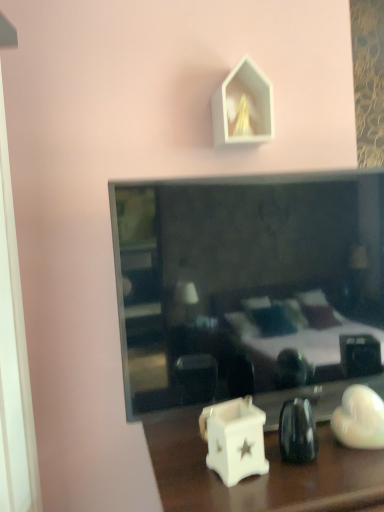
Question: From a real-world perspective, is white glossy candle holder at lower center located beneath white matte house-shaped object at upper center?

Choices:
 (A) no
 (B) yes

Answer: (B)

Question: From the image's perspective, is white glossy candle holder at lower center above white matte house-shaped object at upper center?

Choices:
 (A) yes
 (B) no

Answer: (B)

Question: Can you confirm if white glossy candle holder at lower center is shorter than white matte house-shaped object at upper center?

Choices:
 (A) yes
 (B) no

Answer: (B)

Question: Is white matte house-shaped object at upper center a part of white glossy candle holder at lower center?

Choices:
 (A) yes
 (B) no

Answer: (B)

Question: Is white glossy candle holder at lower center smaller than white matte house-shaped object at upper center?

Choices:
 (A) no
 (B) yes

Answer: (A)

Question: Looking at their shapes, would you say white matte house-shaped object at upper center is wider or thinner than white glossy candle holder at lower center?

Choices:
 (A) thin
 (B) wide

Answer: (A)

Question: Would you say white matte house-shaped object at upper center is inside or outside white glossy candle holder at lower center?

Choices:
 (A) outside
 (B) inside

Answer: (A)

Question: From the image's perspective, is white matte house-shaped object at upper center positioned above or below white glossy candle holder at lower center?

Choices:
 (A) above
 (B) below

Answer: (A)

Question: Is point (226, 111) closer or farther from the camera than point (183, 482)?

Choices:
 (A) farther
 (B) closer

Answer: (A)

Question: From the image's perspective, is smooth glass mirror at center above or below white matte house-shaped object at upper center?

Choices:
 (A) below
 (B) above

Answer: (A)

Question: Considering the positions of smooth glass mirror at center and white matte house-shaped object at upper center in the image, is smooth glass mirror at center taller or shorter than white matte house-shaped object at upper center?

Choices:
 (A) short
 (B) tall

Answer: (B)

Question: From a real-world perspective, is smooth glass mirror at center above or below white matte house-shaped object at upper center?

Choices:
 (A) above
 (B) below

Answer: (B)

Question: Looking at their shapes, would you say smooth glass mirror at center is wider or thinner than white matte house-shaped object at upper center?

Choices:
 (A) wide
 (B) thin

Answer: (A)

Question: In the image, is smooth glass mirror at center positioned in front of or behind white glossy candle holder at lower center?

Choices:
 (A) front
 (B) behind

Answer: (B)

Question: From a real-world perspective, is smooth glass mirror at center physically located above or below white glossy candle holder at lower center?

Choices:
 (A) below
 (B) above

Answer: (B)